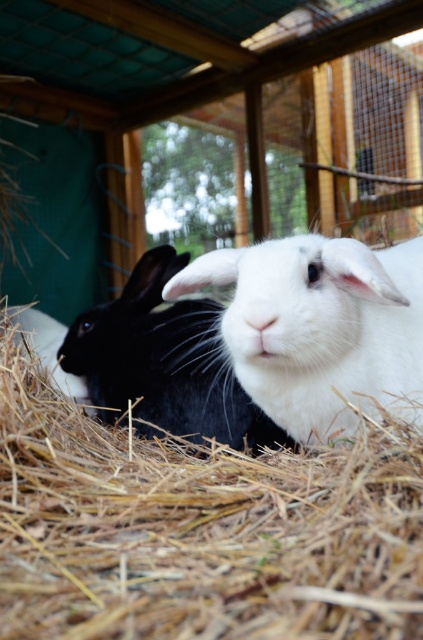
You are a farmer checking the rabbit hutch. You notice the straw hay at center and the black soft fur rabbit at left. Which object takes up more space in the enclosure?

The black soft fur rabbit at left takes up more space than the straw hay at center because the straw hay at center has a smaller size compared to black soft fur rabbit at left.

You are a farmer checking the rabbits in their hutch. You notice the white soft fur rabbit at center and the black soft fur rabbit at left. Which rabbit is closer to the front of the hutch?

The white soft fur rabbit at center is shorter than the black soft fur rabbit at left, so the white soft fur rabbit at center is closer to the front of the hutch.

You are a small animal trying to reach the white soft fur rabbit at center from the straw hay at center. Which direction should you move?

The straw hay at center is to the left of white soft fur rabbit at center, so you should move to the right to reach the white soft fur rabbit at center.